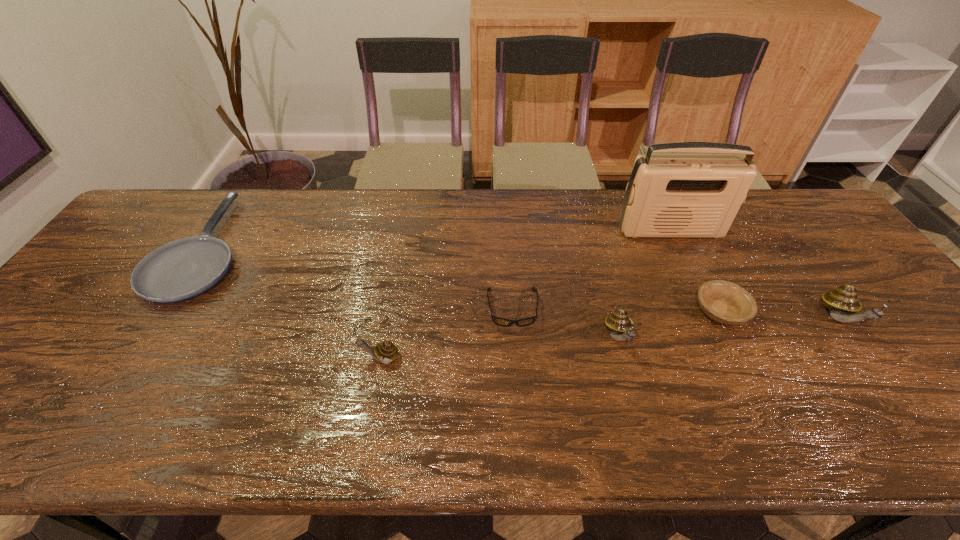
Where is `free space at the near right corner of the desktop`? free space at the near right corner of the desktop is located at coordinates (952, 374).

The height and width of the screenshot is (540, 960). I want to click on vacant area that lies between the shortest snail and the leftmost object, so click(293, 303).

You are a GUI agent. You are given a task and a screenshot of the screen. Output one action in this format:
    pyautogui.click(x=<x>, y=<y>)
    Task: Click on the free space between the tallest object and the fourth shortest object
    The width and height of the screenshot is (960, 540).
    Given the screenshot: What is the action you would take?
    pyautogui.click(x=525, y=294)

In order to click on empty space that is in between the bowl and the second snail from right to left in this screenshot , I will do `click(670, 325)`.

Where is `free spot between the second snail from left to right and the radio receiver`? The image size is (960, 540). free spot between the second snail from left to right and the radio receiver is located at coordinates (644, 284).

At what (x,y) coordinates should I click in order to perform the action: click on empty space between the spectacles and the leftmost object. Please return your answer as a coordinate pair (x, y). The image size is (960, 540). Looking at the image, I should click on (358, 278).

You are a GUI agent. You are given a task and a screenshot of the screen. Output one action in this format:
    pyautogui.click(x=<x>, y=<y>)
    Task: Click on the empty space between the frying pan and the rightmost object
    The width and height of the screenshot is (960, 540).
    Given the screenshot: What is the action you would take?
    pyautogui.click(x=522, y=284)

At what (x,y) coordinates should I click in order to perform the action: click on vacant area between the radio receiver and the leftmost object. Please return your answer as a coordinate pair (x, y). This screenshot has height=540, width=960. Looking at the image, I should click on (437, 239).

The height and width of the screenshot is (540, 960). What are the coordinates of `vacant space in between the rightmost object and the spectacles` in the screenshot? It's located at (677, 314).

Find the location of a particular element. This screenshot has height=540, width=960. the second closest object to the shortest snail is located at coordinates (184, 268).